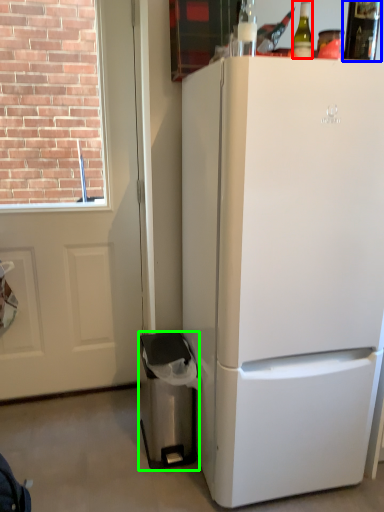
Question: Considering the real-world distances, which object is farthest from bottle (highlighted by a red box)? bottle (highlighted by a blue box) or trash bin/can (highlighted by a green box)?

Choices:
 (A) bottle
 (B) trash bin/can

Answer: (B)